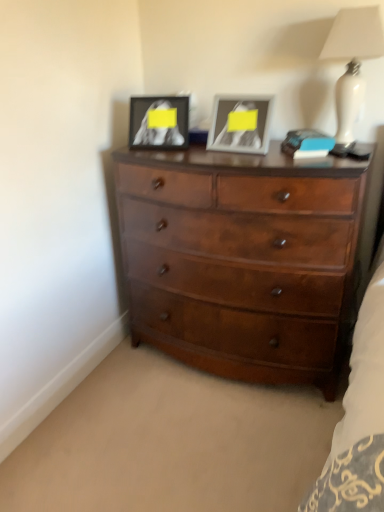
Where is `vacant area situated to the left side of shiny brown wooden chest of drawers at center`? vacant area situated to the left side of shiny brown wooden chest of drawers at center is located at coordinates (106, 403).